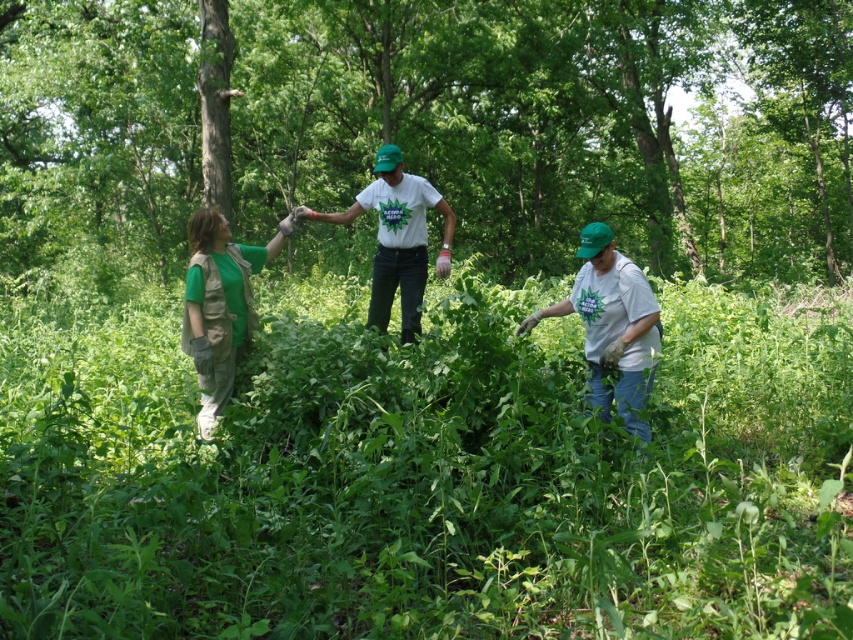
Looking at this image, you are a hiker who wants to take a photo of the green leafy tree at center and the green matte vest at left. Where should you position yourself to capture both in the frame?

To capture both the green leafy tree at center and the green matte vest at left in the frame, position yourself below the green leafy tree at center since it is above the green matte vest at left.